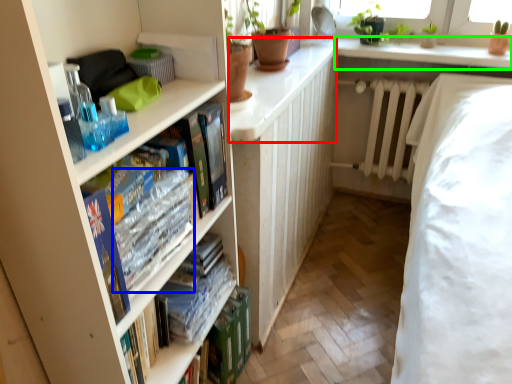
Question: Considering the real-world distances, which object is farthest from counter top (highlighted by a red box)? book (highlighted by a blue box) or window sill (highlighted by a green box)?

Choices:
 (A) book
 (B) window sill

Answer: (B)